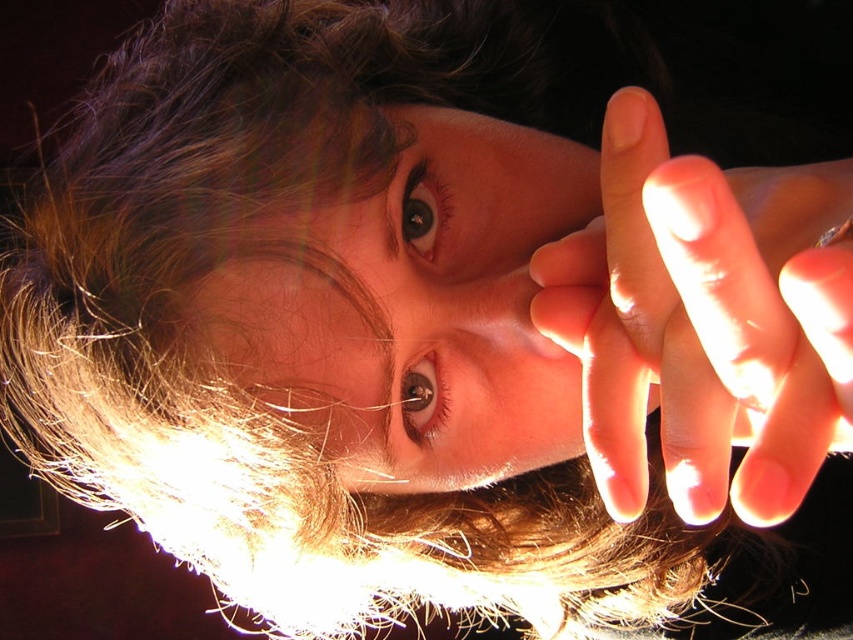
You are a photographer adjusting the lighting for a portrait. You want to ensure both the matte skin face at center and the smooth skin hand at right are well lit. Given their sizes, which object requires a wider light source to capture details properly?

The matte skin face at center requires a wider light source because it has a larger size compared to the smooth skin hand at right, ensuring all details are properly illuminated.

You are a photographer adjusting the lighting for a portrait. The subject has a matte skin face at center. You need to place a reflector at point (413, 308) to highlight the face. Is the reflector placed correctly?

The point (413, 308) is where the matte skin face at center is located, so placing the reflector there would directly illuminate the face, making it the correct position.

You are a photographer setting up a lighting setup for a portrait. You have a matte skin face at center and a smooth skin hand at right in your frame. Based on their positions, which object is closer to the left side of the camera frame?

The matte skin face at center is closer to the left side of the camera frame because it is positioned to the left of the smooth skin hand at right.